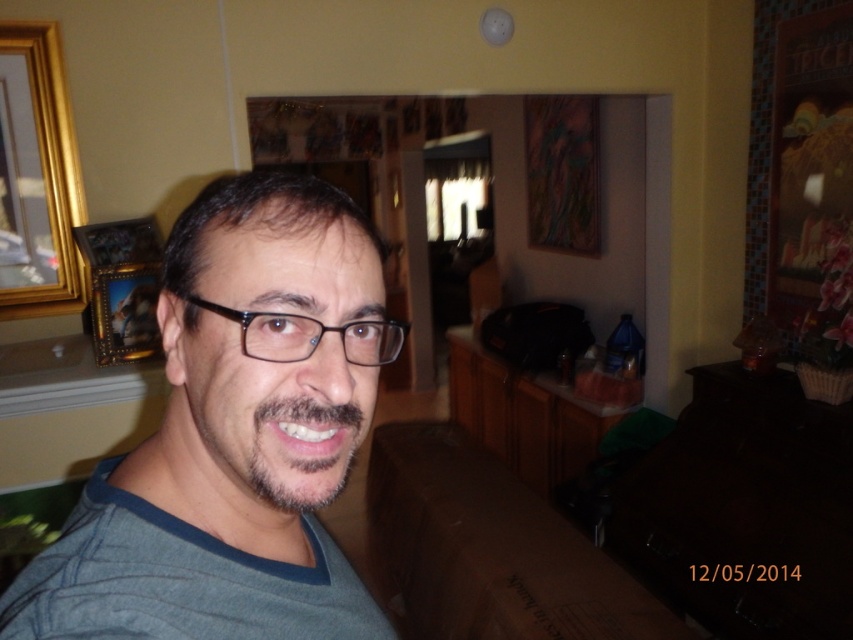
You are a photographer trying to capture both the gray cotton shirt at center and the gold wooden picture frame at upper left in a single shot. Given their sizes, which object would you need to position closer to the camera to ensure both appear similarly sized in the photo?

The gray cotton shirt at center has a smaller size compared to the gold wooden picture frame at upper left. To make them appear similarly sized in the photo, you should move the gray cotton shirt at center closer to the camera while keeping the gold wooden picture frame at upper left at its current distance.